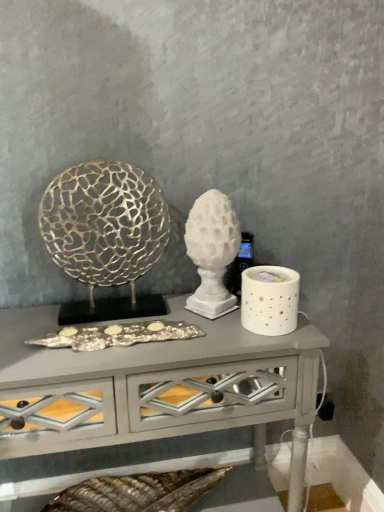
Question: Is white ceramic candle holder at right wider than white matte sculpture at center, which ranks as the 2th sculpture in left-to-right order?

Choices:
 (A) no
 (B) yes

Answer: (B)

Question: Is white ceramic candle holder at right bigger than white matte sculpture at center, which ranks as the 2th sculpture in left-to-right order?

Choices:
 (A) no
 (B) yes

Answer: (A)

Question: Does white ceramic candle holder at right have a lesser height compared to white matte sculpture at center, which ranks as the 2th sculpture in left-to-right order?

Choices:
 (A) yes
 (B) no

Answer: (A)

Question: Is white ceramic candle holder at right taller than white matte sculpture at center, which ranks as the 2th sculpture in left-to-right order?

Choices:
 (A) yes
 (B) no

Answer: (B)

Question: Does white ceramic candle holder at right have a smaller size compared to white matte sculpture at center, placed as the first sculpture when sorted from right to left?

Choices:
 (A) no
 (B) yes

Answer: (B)

Question: Would you say white matte sculpture at center, placed as the first sculpture when sorted from right to left, is to the left or to the right of white ceramic candle holder at right in the picture?

Choices:
 (A) left
 (B) right

Answer: (A)

Question: In terms of width, does white matte sculpture at center, placed as the first sculpture when sorted from right to left, look wider or thinner when compared to white ceramic candle holder at right?

Choices:
 (A) thin
 (B) wide

Answer: (A)

Question: From the image's perspective, is white matte sculpture at center, which ranks as the 2th sculpture in left-to-right order, positioned above or below white ceramic candle holder at right?

Choices:
 (A) above
 (B) below

Answer: (A)

Question: Looking at the image, does white matte sculpture at center, which ranks as the 2th sculpture in left-to-right order, seem bigger or smaller compared to white ceramic candle holder at right?

Choices:
 (A) small
 (B) big

Answer: (B)

Question: Considering their positions, is white ceramic candle holder at right located in front of or behind white matte sculpture at center, which ranks as the 2th sculpture in left-to-right order?

Choices:
 (A) behind
 (B) front

Answer: (B)

Question: Considering the positions of white ceramic candle holder at right and white matte sculpture at center, placed as the first sculpture when sorted from right to left, in the image, is white ceramic candle holder at right wider or thinner than white matte sculpture at center, placed as the first sculpture when sorted from right to left,?

Choices:
 (A) wide
 (B) thin

Answer: (A)

Question: Is white ceramic candle holder at right bigger or smaller than white matte sculpture at center, which ranks as the 2th sculpture in left-to-right order?

Choices:
 (A) big
 (B) small

Answer: (B)

Question: Is white ceramic candle holder at right inside or outside of white matte sculpture at center, placed as the first sculpture when sorted from right to left?

Choices:
 (A) outside
 (B) inside

Answer: (A)

Question: Looking at the image, does white glossy table at center seem bigger or smaller compared to white matte sculpture at center, which ranks as the 2th sculpture in left-to-right order?

Choices:
 (A) small
 (B) big

Answer: (B)

Question: From a real-world perspective, is white glossy table at center positioned above or below white matte sculpture at center, placed as the first sculpture when sorted from right to left?

Choices:
 (A) above
 (B) below

Answer: (B)